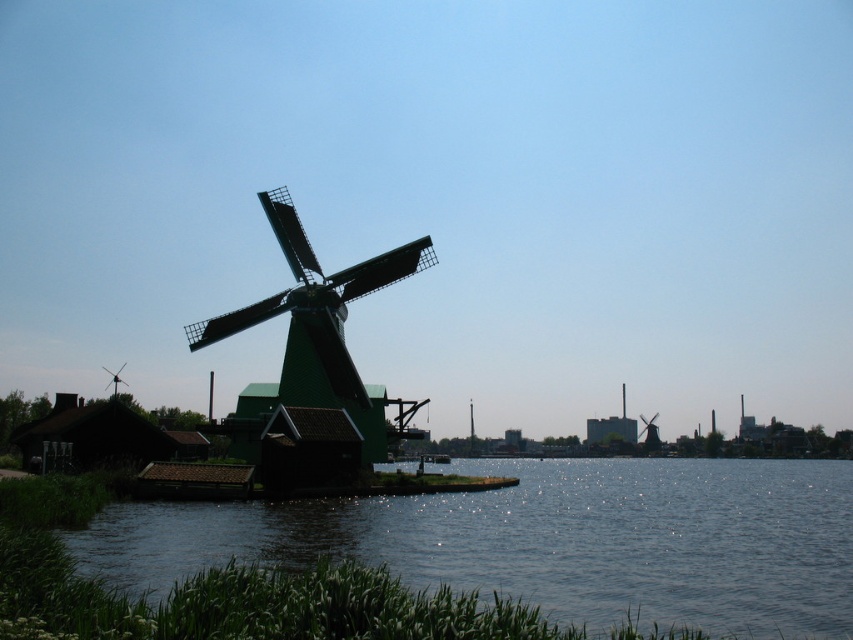
Question: From the image, what is the correct spatial relationship of green smooth water at lower left in relation to green matte windmill at center?

Choices:
 (A) below
 (B) above

Answer: (A)

Question: Is green smooth water at lower left thinner than green matte windmill at center?

Choices:
 (A) no
 (B) yes

Answer: (A)

Question: Which of the following is the closest to the observer?

Choices:
 (A) (224, 419)
 (B) (418, 573)

Answer: (B)

Question: Considering the relative positions of green smooth water at lower left and green matte windmill at center in the image provided, where is green smooth water at lower left located with respect to green matte windmill at center?

Choices:
 (A) left
 (B) right

Answer: (B)